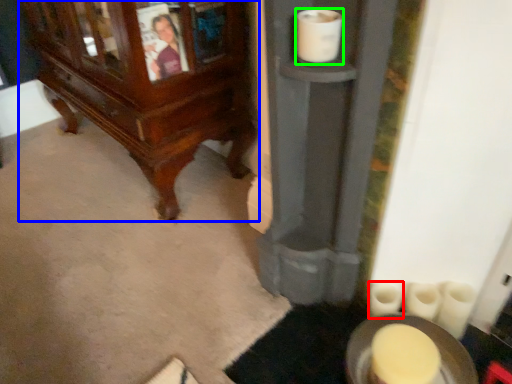
Question: Considering the real-world distances, which object is farthest from toilet paper (highlighted by a red box)? furniture (highlighted by a blue box) or toilet paper (highlighted by a green box)?

Choices:
 (A) furniture
 (B) toilet paper

Answer: (A)